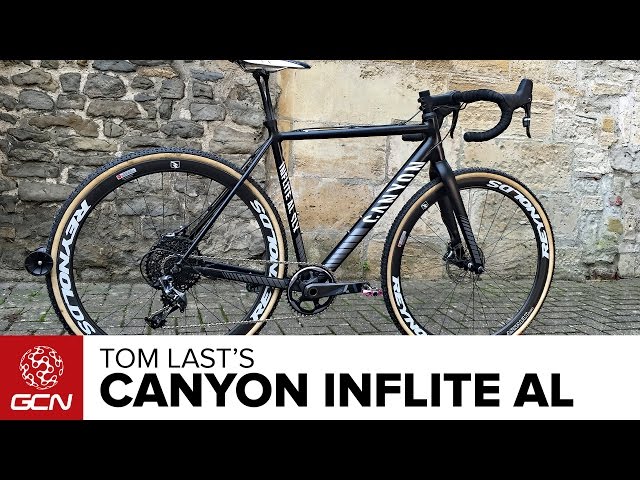
You are a GUI agent. You are given a task and a screenshot of the screen. Output one action in this format:
    pyautogui.click(x=<x>, y=<y>)
    Task: Click on the seat
    The width and height of the screenshot is (640, 480).
    Given the screenshot: What is the action you would take?
    pyautogui.click(x=269, y=64)